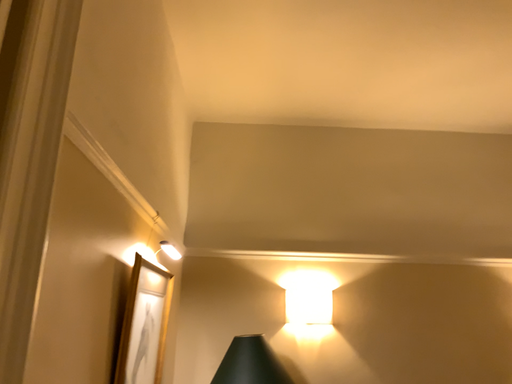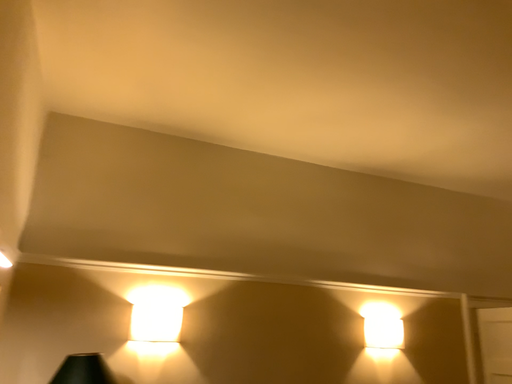
Question: How did the camera likely rotate when shooting the video?

Choices:
 (A) rotated left
 (B) rotated right

Answer: (B)